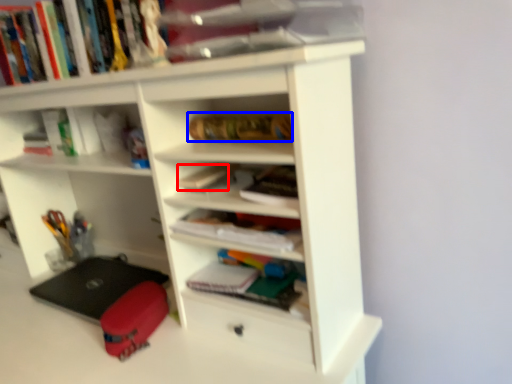
Question: Which of the following is the farthest to the observer, book (highlighted by a red box) or book (highlighted by a blue box)?

Choices:
 (A) book
 (B) book

Answer: (A)